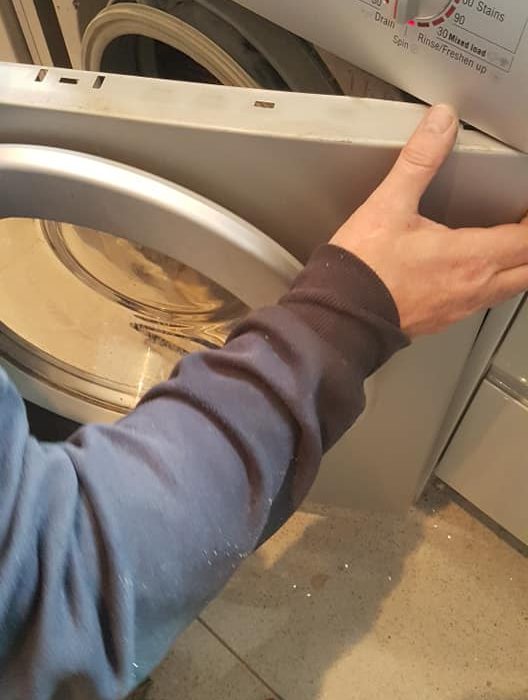
Where is `washing machine door frame`? washing machine door frame is located at coordinates (145, 209).